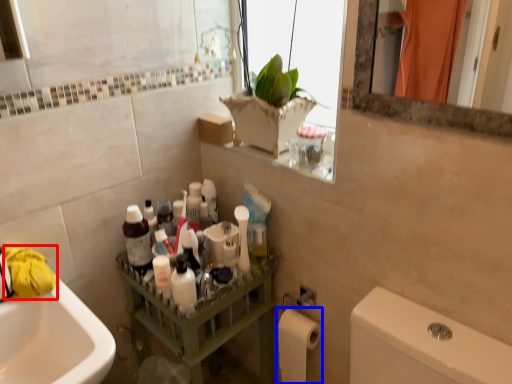
Question: Among these objects, which one is farthest to the camera, material (highlighted by a red box) or toilet paper (highlighted by a blue box)?

Choices:
 (A) material
 (B) toilet paper

Answer: (B)